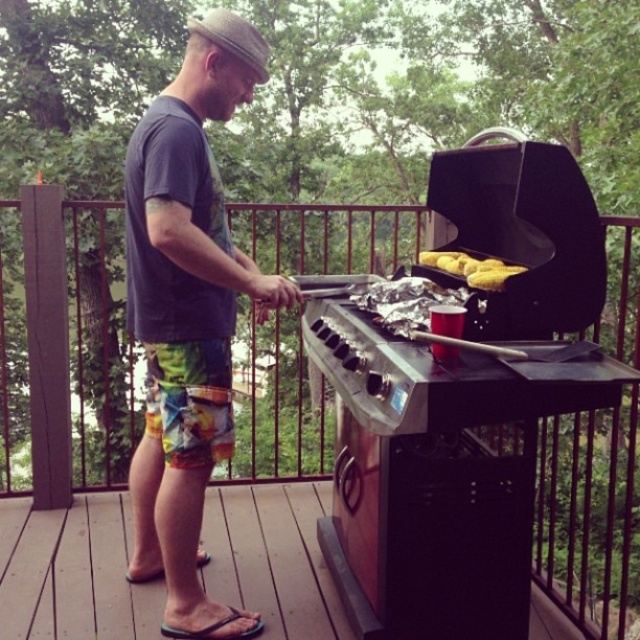
You are a guest at a backyard barbecue and want to place a plate on the grill to keep it warm. The plate is the same size as the yellow matte corn at center. Will the black matte barbecue grill at center have enough space to accommodate the plate?

The black matte barbecue grill at center has a larger width than the yellow matte corn at center, so the plate, which is the same size as the corn, should fit on the grill.

You are a photographer trying to capture the man in the scene. You want to ensure both the multicolored printed shorts at lower center and the yellow matte corn at center are clearly visible in the photo. Which object should you focus on to ensure the smaller one is in sharp focus?

The yellow matte corn at center is smaller than the multicolored printed shorts at lower center, so you should focus on the yellow matte corn at center to ensure it is in sharp focus.

You are a guest at a barbecue and want to place a plate on the wooden deck at lower left and the yellow matte corn at center. Which surface is higher?

The wooden deck at lower left is taller than the yellow matte corn at center, so the wooden deck at lower left is higher.